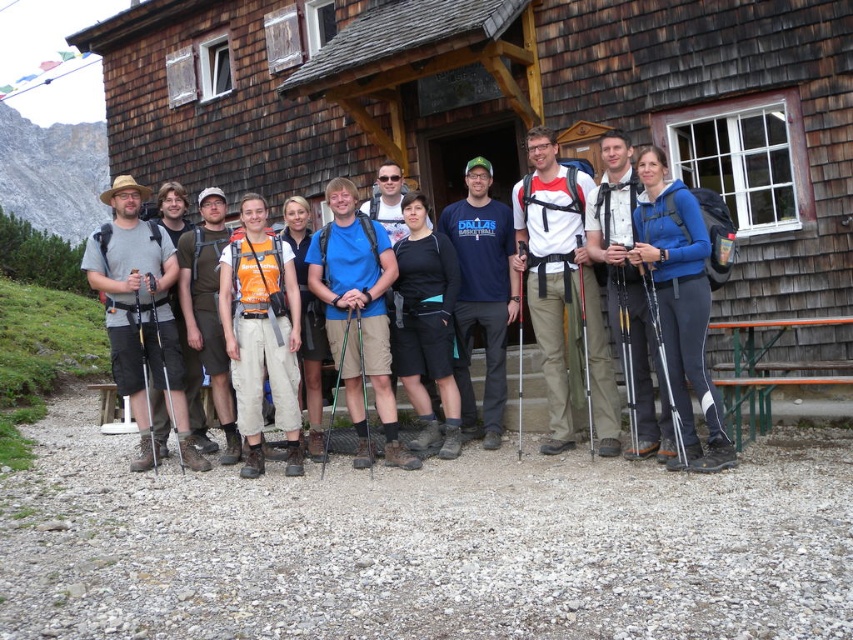
Which of these two, blue matte shirt at center or green metallic ski pole at center, stands taller?

With more height is blue matte shirt at center.

The image size is (853, 640). What do you see at coordinates (358, 314) in the screenshot?
I see `blue matte shirt at center` at bounding box center [358, 314].

The image size is (853, 640). Identify the location of blue matte shirt at center. (358, 314).

Which is above, matte black backpack at center or black rubber ski pole at left?

Positioned higher is matte black backpack at center.

Between point (579, 252) and point (149, 413), which one is positioned behind?

The point (149, 413) is more distant.

In order to click on matte black backpack at center in this screenshot , I will do `click(674, 355)`.

Who is higher up, silver metallic ski pole at center or black plastic ski pole at center?

black plastic ski pole at center is above.

Measure the distance from silver metallic ski pole at center to black plastic ski pole at center.

They are 1.99 meters apart.

Is point (587, 378) positioned in front of point (521, 362)?

Yes.

You are a GUI agent. You are given a task and a screenshot of the screen. Output one action in this format:
    pyautogui.click(x=<x>, y=<y>)
    Task: Click on the silver metallic ski pole at center
    The height and width of the screenshot is (640, 853).
    Given the screenshot: What is the action you would take?
    pyautogui.click(x=585, y=355)